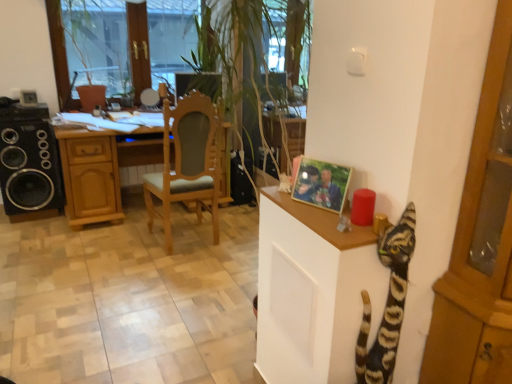
This screenshot has width=512, height=384. I want to click on free space in front of light brown wood chair at center, so (x=172, y=274).